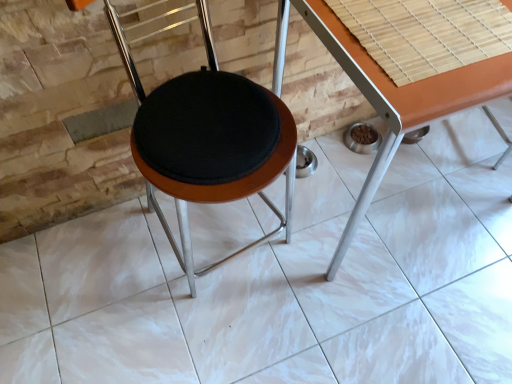
Question: Can you confirm if black fabric cushion at center is wider than orange laminate table at center?

Choices:
 (A) yes
 (B) no

Answer: (B)

Question: Is black fabric cushion at center not inside orange laminate table at center?

Choices:
 (A) yes
 (B) no

Answer: (A)

Question: Considering the relative positions of black fabric cushion at center and orange laminate table at center in the image provided, is black fabric cushion at center behind orange laminate table at center?

Choices:
 (A) no
 (B) yes

Answer: (A)

Question: Does black fabric cushion at center have a greater height compared to orange laminate table at center?

Choices:
 (A) yes
 (B) no

Answer: (A)

Question: Can you confirm if black fabric cushion at center is smaller than orange laminate table at center?

Choices:
 (A) no
 (B) yes

Answer: (B)

Question: Considering the positions of black fabric cushion at center and orange laminate table at center in the image, is black fabric cushion at center wider or thinner than orange laminate table at center?

Choices:
 (A) thin
 (B) wide

Answer: (A)

Question: Is point (288, 115) positioned closer to the camera than point (394, 147)?

Choices:
 (A) farther
 (B) closer

Answer: (A)

Question: Which is correct: black fabric cushion at center is inside orange laminate table at center, or outside of it?

Choices:
 (A) inside
 (B) outside

Answer: (B)

Question: Considering the positions of black fabric cushion at center and orange laminate table at center in the image, is black fabric cushion at center bigger or smaller than orange laminate table at center?

Choices:
 (A) small
 (B) big

Answer: (A)

Question: Is orange laminate table at center situated inside bamboo mat at upper right or outside?

Choices:
 (A) inside
 (B) outside

Answer: (B)

Question: Based on their positions, is orange laminate table at center located to the left or right of bamboo mat at upper right?

Choices:
 (A) right
 (B) left

Answer: (A)

Question: From the image's perspective, is orange laminate table at center located above or below bamboo mat at upper right?

Choices:
 (A) above
 (B) below

Answer: (B)

Question: From their relative heights in the image, would you say orange laminate table at center is taller or shorter than bamboo mat at upper right?

Choices:
 (A) tall
 (B) short

Answer: (A)

Question: From a real-world perspective, is orange laminate table at center physically located above or below black fabric cushion at center?

Choices:
 (A) above
 (B) below

Answer: (B)

Question: Is point (342, 251) positioned closer to the camera than point (227, 102)?

Choices:
 (A) farther
 (B) closer

Answer: (A)